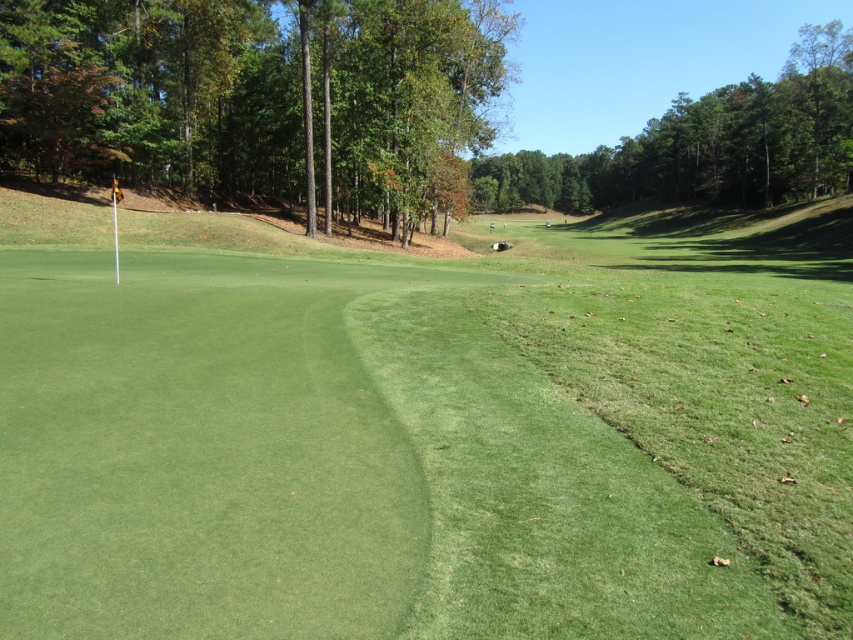
You are a golfer standing at the base of the green leafy tree at upper center. You want to reach the green leafy tree at upper right to retrieve a lost golf ball. Given that your average walking pace is 1.5 meters per second, how long will it take you to walk directly between the two trees?

The distance between the green leafy tree at upper center and the green leafy tree at upper right is 57.95 meters. At a pace of 1.5 meters per second, it would take approximately 38.63 seconds to walk between them.

You are a golfer standing at the edge of the putting green. You see two points on the golf course marked as point [534,332] and point [364,168]. Which point is closer to your current position?

Point [534,332] is closer to the camera than point [364,168], so the golfer is closer to point [534,332].